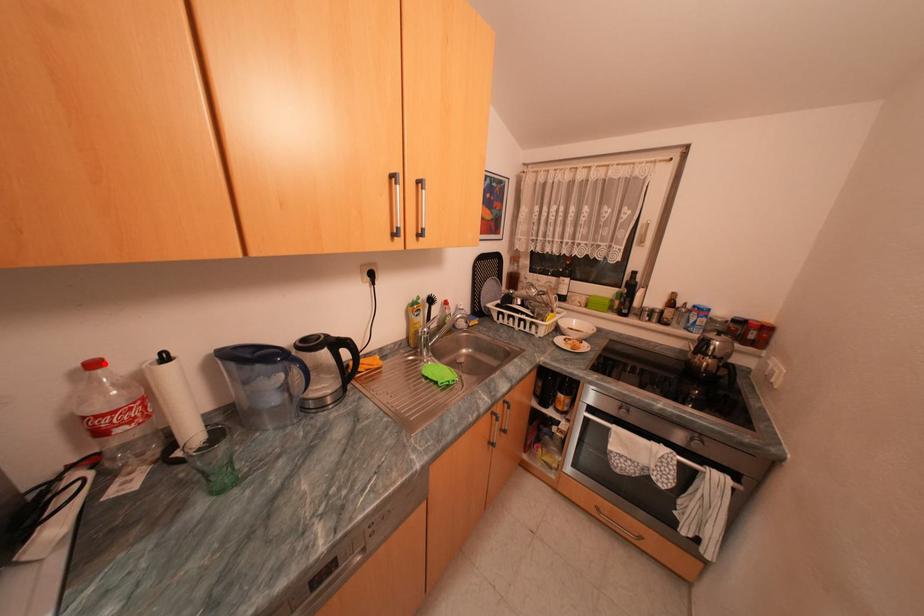
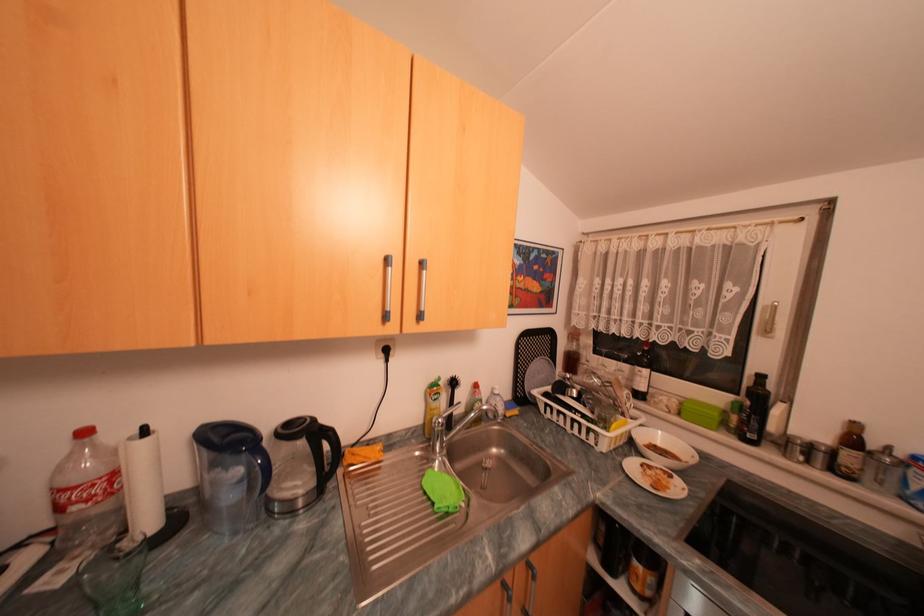
In the second image, find the point that corresponds to the highlighted location in the first image.

(94, 432)